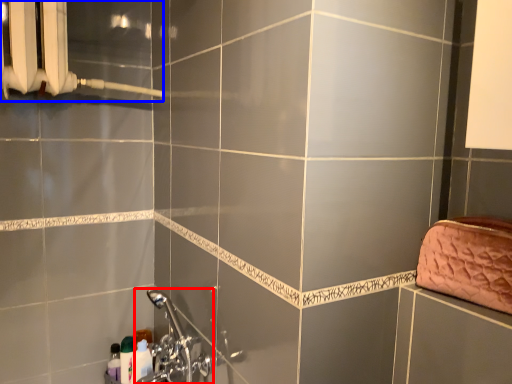
Question: Which of the following is the farthest to the observer, plumbing fixture (highlighted by a red box) or shower (highlighted by a blue box)?

Choices:
 (A) plumbing fixture
 (B) shower

Answer: (A)